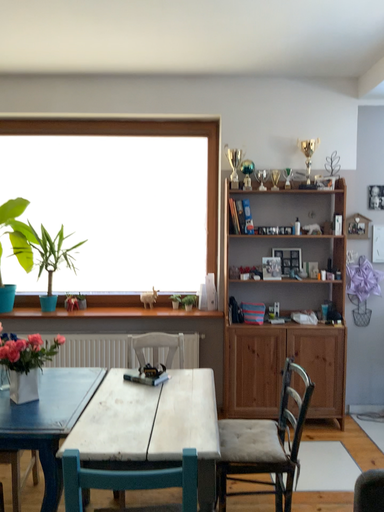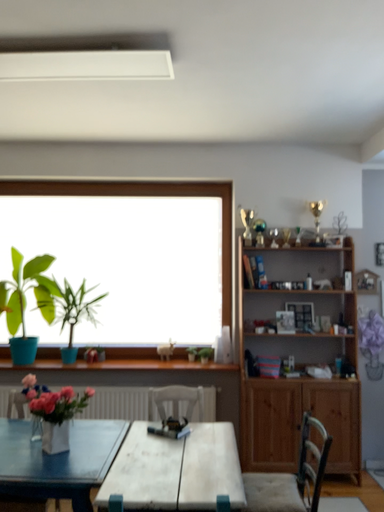
Question: Which way did the camera rotate in the video?

Choices:
 (A) rotated downward
 (B) rotated upward

Answer: (B)